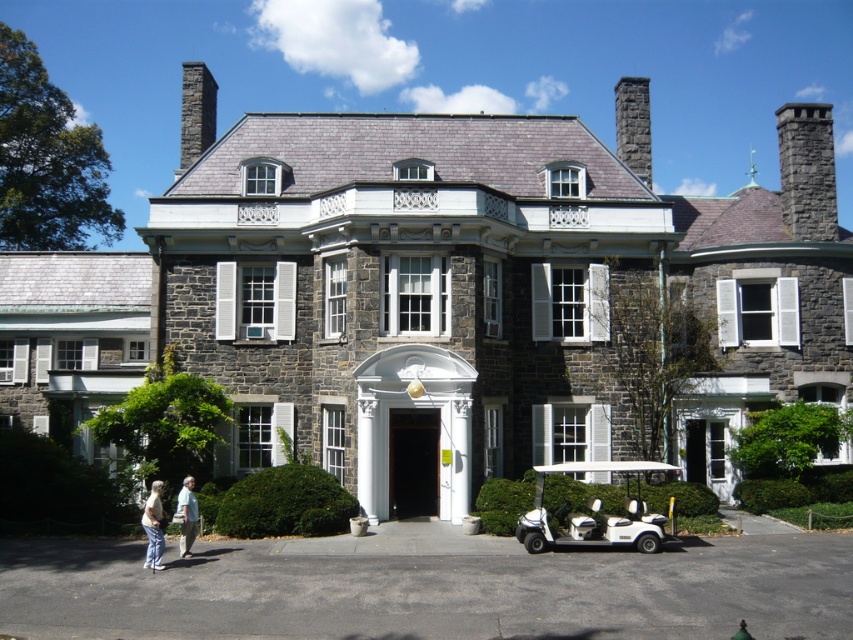
Question: Which object is the farthest from the stone mansion at center?

Choices:
 (A) white cotton shirt at lower left
 (B) black asphalt at lower center

Answer: (A)

Question: Is white cotton shirt at lower left behind white fabric at lower left?

Choices:
 (A) no
 (B) yes

Answer: (A)

Question: Can you confirm if white plastic golf cart at lower right is positioned below white cotton shirt at lower left?

Choices:
 (A) no
 (B) yes

Answer: (A)

Question: Is white plastic golf cart at lower right to the right of white cotton shirt at lower left from the viewer's perspective?

Choices:
 (A) yes
 (B) no

Answer: (A)

Question: Which of the following is the farthest from the observer?

Choices:
 (A) (798, 556)
 (B) (183, 544)

Answer: (A)

Question: Among these objects, which one is nearest to the camera?

Choices:
 (A) white fabric at lower left
 (B) black asphalt at lower center
 (C) white plastic golf cart at lower right

Answer: (B)